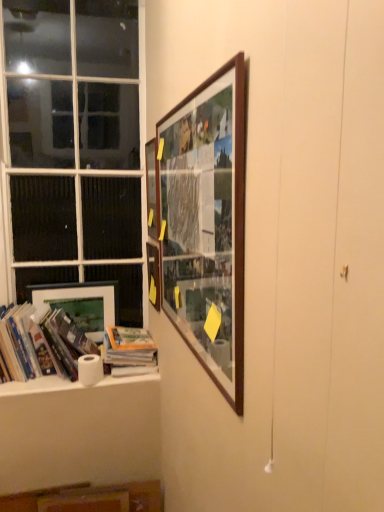
What do you see at coordinates (89, 498) in the screenshot?
I see `wooden cabinet at lower center` at bounding box center [89, 498].

The width and height of the screenshot is (384, 512). Describe the element at coordinates (68, 384) in the screenshot. I see `white paper towel at lower left` at that location.

Measure the distance between point (147,203) and camera.

Point (147,203) and camera are 1.85 meters apart.

Locate an element on the screen. The image size is (384, 512). hardcover book at lower left, which ranks as the second book in left-to-right order is located at coordinates (130, 351).

The height and width of the screenshot is (512, 384). Describe the element at coordinates (153, 275) in the screenshot. I see `wooden picture frame at upper center, which appears as the third picture frame when viewed from the front` at that location.

At what (x,y) coordinates should I click in order to perform the action: click on matte wooden picture frame at lower left, the fourth picture frame when ordered from right to left. Please return your answer as a coordinate pair (x, y). Image resolution: width=384 pixels, height=512 pixels. Looking at the image, I should click on (82, 304).

This screenshot has height=512, width=384. I want to click on wooden cabinet at lower center, so [89, 498].

Considering the sizes of wooden picture frame at upper center, which appears as the third picture frame when viewed from the front, and hardcover books at left, the 2th book in the right-to-left sequence, in the image, is wooden picture frame at upper center, which appears as the third picture frame when viewed from the front, wider or thinner than hardcover books at left, the 2th book in the right-to-left sequence,?

Clearly, wooden picture frame at upper center, which appears as the third picture frame when viewed from the front, has less width compared to hardcover books at left, the 2th book in the right-to-left sequence.

Which is behind, wooden picture frame at upper center, the third picture frame when ordered from right to left, or hardcover books at left, placed as the first book when sorted from left to right?

wooden picture frame at upper center, the third picture frame when ordered from right to left, is further away from the camera.

Which is correct: wooden picture frame at upper center, acting as the second picture frame starting from the left, is inside hardcover books at left, the 2th book in the right-to-left sequence, or outside of it?

wooden picture frame at upper center, acting as the second picture frame starting from the left, cannot be found inside hardcover books at left, the 2th book in the right-to-left sequence.

Is wooden picture frame at upper center, which is the 2th picture frame in back-to-front order, facing away from hardcover books at left, the 2th book in the right-to-left sequence?

No.

Can you confirm if wooden frame at upper center, the 2th picture frame when ordered from right to left, is thinner than hardcover book at lower left, which ranks as the second book in left-to-right order?

Yes, wooden frame at upper center, the 2th picture frame when ordered from right to left, is thinner than hardcover book at lower left, which ranks as the second book in left-to-right order.

From a real-world perspective, is wooden frame at upper center, the 2th picture frame when ordered from right to left, beneath hardcover book at lower left, which ranks as the second book in left-to-right order?

Actually, wooden frame at upper center, the 2th picture frame when ordered from right to left, is physically above hardcover book at lower left, which ranks as the second book in left-to-right order, in the real world.

Where is `the 2nd picture frame in front of the hardcover book at lower left, the 1th book positioned from the right`? This screenshot has height=512, width=384. the 2nd picture frame in front of the hardcover book at lower left, the 1th book positioned from the right is located at coordinates (152, 189).

Considering the relative sizes of wooden frame at upper center, the 3th picture frame in the back-to-front sequence, and hardcover book at lower left, the 1th book positioned from the right, in the image provided, is wooden frame at upper center, the 3th picture frame in the back-to-front sequence, bigger than hardcover book at lower left, the 1th book positioned from the right,?

Actually, wooden frame at upper center, the 3th picture frame in the back-to-front sequence, might be smaller than hardcover book at lower left, the 1th book positioned from the right.

From the image's perspective, relative to wooden cabinet at lower center, is wooden picture frame at upper center, acting as the second picture frame starting from the left, above or below?

wooden picture frame at upper center, acting as the second picture frame starting from the left, is above wooden cabinet at lower center.

Which object is closer to the camera taking this photo, wooden picture frame at upper center, the third picture frame when ordered from right to left, or wooden cabinet at lower center?

wooden cabinet at lower center is in front.

Is wooden picture frame at upper center, which appears as the third picture frame when viewed from the front, bigger than wooden cabinet at lower center?

Actually, wooden picture frame at upper center, which appears as the third picture frame when viewed from the front, might be smaller than wooden cabinet at lower center.

Is hardcover books at left, the 2th book in the right-to-left sequence, bigger than hardcover book at lower left, which ranks as the second book in left-to-right order?

Correct, hardcover books at left, the 2th book in the right-to-left sequence, is larger in size than hardcover book at lower left, which ranks as the second book in left-to-right order.

In order to click on book located behind the hardcover books at left, placed as the first book when sorted from left to right in this screenshot , I will do `click(130, 351)`.

In the image, is hardcover books at left, placed as the first book when sorted from left to right, on the left side or the right side of hardcover book at lower left, which ranks as the second book in left-to-right order?

hardcover books at left, placed as the first book when sorted from left to right, is positioned on hardcover book at lower left, which ranks as the second book in left-to-right order,'s left side.

From the picture: Which is farther, (7, 370) or (121, 341)?

The point (121, 341) is behind.

Is wooden picture frame at upper center, the third picture frame when ordered from right to left, aimed at wooden picture frame at upper center, placed as the 1th picture frame when sorted from right to left?

No, wooden picture frame at upper center, the third picture frame when ordered from right to left, does not turn towards wooden picture frame at upper center, placed as the 1th picture frame when sorted from right to left.

Considering the positions of objects wooden picture frame at upper center, acting as the second picture frame starting from the left, and wooden picture frame at upper center, marked as the 1th picture frame in a front-to-back arrangement, in the image provided, who is more to the left, wooden picture frame at upper center, acting as the second picture frame starting from the left, or wooden picture frame at upper center, marked as the 1th picture frame in a front-to-back arrangement,?

wooden picture frame at upper center, acting as the second picture frame starting from the left, is more to the left.

Does wooden picture frame at upper center, which appears as the third picture frame when viewed from the front, have a smaller size compared to wooden picture frame at upper center, placed as the 1th picture frame when sorted from right to left?

Yes.

Considering the relative sizes of wooden picture frame at upper center, which is the 2th picture frame in back-to-front order, and wooden picture frame at upper center, which is counted as the fourth picture frame, starting from the left, in the image provided, is wooden picture frame at upper center, which is the 2th picture frame in back-to-front order, thinner than wooden picture frame at upper center, which is counted as the fourth picture frame, starting from the left,?

Indeed, wooden picture frame at upper center, which is the 2th picture frame in back-to-front order, has a lesser width compared to wooden picture frame at upper center, which is counted as the fourth picture frame, starting from the left.

From a real-world perspective, is hardcover books at left, the 2th book in the right-to-left sequence, on white glass window at left?

No.

Does point (44, 322) appear closer or farther from the camera than point (77, 211)?

Point (44, 322).

How distant is hardcover books at left, placed as the first book when sorted from left to right, from white glass window at left?

The distance of hardcover books at left, placed as the first book when sorted from left to right, from white glass window at left is 23.32 inches.

Which of these two, hardcover books at left, placed as the first book when sorted from left to right, or white glass window at left, is smaller?

hardcover books at left, placed as the first book when sorted from left to right.

At what (x,y) coordinates should I click in order to perform the action: click on toilet paper on the right of white paper towel at lower left. Please return your answer as a coordinate pair (x, y). This screenshot has width=384, height=512. Looking at the image, I should click on (90, 369).

Considering their positions, is white matte toilet paper at lower left located in front of or behind white paper towel at lower left?

white matte toilet paper at lower left is behind white paper towel at lower left.

Which of these two, white matte toilet paper at lower left or white paper towel at lower left, is smaller?

white matte toilet paper at lower left.

The image size is (384, 512). Identify the location of the 1st book below the wooden picture frame at upper center, which is the 2th picture frame in back-to-front order (from a real-world perspective). (41, 344).

From the image's perspective, count 4th picture frames upward from the hardcover book at lower left, which ranks as the second book in left-to-right order, and point to it. Please provide its 2D coordinates.

[(152, 189)]

When comparing their distances from matte wooden picture frame at lower left, the first picture frame from the back, does hardcover books at left, placed as the first book when sorted from left to right, or wooden picture frame at upper center, which is counted as the fourth picture frame, starting from the left, seem further?

Based on the image, wooden picture frame at upper center, which is counted as the fourth picture frame, starting from the left, appears to be further to matte wooden picture frame at lower left, the first picture frame from the back.

Considering their positions, is wooden frame at upper center, the 3th picture frame in the back-to-front sequence, positioned closer to white paper towel at lower left than white matte toilet paper at lower left?

white matte toilet paper at lower left is closer to white paper towel at lower left.

Which object lies nearer to the anchor point wooden frame at upper center, positioned as the 3th picture frame in left-to-right order, white matte toilet paper at lower left or hardcover book at lower left, the 1th book positioned from the right?

The object closer to wooden frame at upper center, positioned as the 3th picture frame in left-to-right order, is hardcover book at lower left, the 1th book positioned from the right.

From the image, which object appears to be nearer to white matte toilet paper at lower left, matte wooden picture frame at lower left, marked as the 4th picture frame in a front-to-back arrangement, or wooden cabinet at lower center?

matte wooden picture frame at lower left, marked as the 4th picture frame in a front-to-back arrangement, is positioned closer to the anchor white matte toilet paper at lower left.

Based on their spatial positions, is wooden cabinet at lower center or wooden picture frame at upper center, marked as the 1th picture frame in a front-to-back arrangement, closer to wooden frame at upper center, the 2th picture frame when ordered from right to left?

The object closer to wooden frame at upper center, the 2th picture frame when ordered from right to left, is wooden picture frame at upper center, marked as the 1th picture frame in a front-to-back arrangement.

In the scene shown: Which object lies nearer to the anchor point hardcover book at lower left, which ranks as the second book in left-to-right order, white glass window at left or wooden cabinet at lower center?

wooden cabinet at lower center is closer to hardcover book at lower left, which ranks as the second book in left-to-right order.

From the picture: When comparing their distances from wooden cabinet at lower center, does matte wooden picture frame at lower left, marked as the 1th picture frame in a left-to-right arrangement, or hardcover books at left, placed as the first book when sorted from left to right, seem further?

The object further to wooden cabinet at lower center is matte wooden picture frame at lower left, marked as the 1th picture frame in a left-to-right arrangement.

Estimate the real-world distances between objects in this image. Which object is closer to wooden frame at upper center, the 3th picture frame in the back-to-front sequence, hardcover book at lower left, the 1th book positioned from the right, or matte wooden picture frame at lower left, marked as the 1th picture frame in a left-to-right arrangement?

matte wooden picture frame at lower left, marked as the 1th picture frame in a left-to-right arrangement, is closer to wooden frame at upper center, the 3th picture frame in the back-to-front sequence.

At what (x,y) coordinates should I click in order to perform the action: click on window sill between hardcover book at lower left, which ranks as the second book in left-to-right order, and wooden cabinet at lower center in the up-down direction. Please return your answer as a coordinate pair (x, y). Looking at the image, I should click on (68, 384).

Where is `picture frame between hardcover books at left, the 2th book in the right-to-left sequence, and wooden picture frame at upper center, acting as the second picture frame starting from the left`? picture frame between hardcover books at left, the 2th book in the right-to-left sequence, and wooden picture frame at upper center, acting as the second picture frame starting from the left is located at coordinates (82, 304).

Identify the location of picture frame between wooden picture frame at upper center, acting as the second picture frame starting from the left, and wooden cabinet at lower center from top to bottom. (82, 304).

Find the location of a particular element. The image size is (384, 512). cabinet between wooden picture frame at upper center, which is the 4th picture frame in back-to-front order, and matte wooden picture frame at lower left, the first picture frame from the back, in the front-back direction is located at coordinates (89, 498).